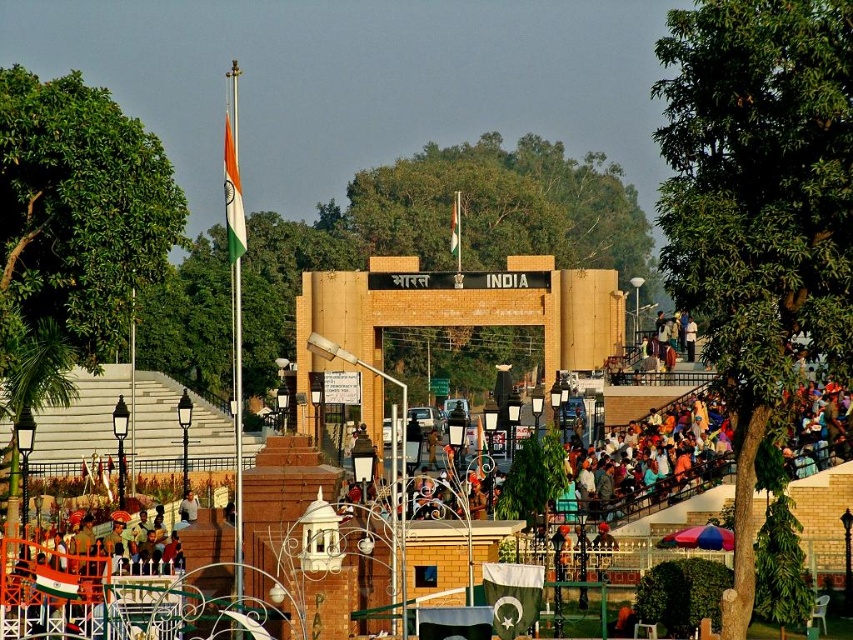
Question: Is tri-color fabric flag at upper center positioned behind tri-color fabric flag at center?

Choices:
 (A) no
 (B) yes

Answer: (A)

Question: Which object is farther from the camera taking this photo?

Choices:
 (A) tri-color fabric flag at center
 (B) tri-color fabric flag at upper center

Answer: (A)

Question: Among these objects, which one is nearest to the camera?

Choices:
 (A) tri-color fabric flag at upper center
 (B) tri-color fabric flag at center

Answer: (A)

Question: Where is tri-color fabric flag at upper center located in relation to tri-color fabric flag at center in the image?

Choices:
 (A) above
 (B) below

Answer: (A)

Question: Can you confirm if tri-color fabric flag at upper center is bigger than tri-color fabric flag at center?

Choices:
 (A) no
 (B) yes

Answer: (B)

Question: Which point is farther from the camera taking this photo?

Choices:
 (A) (456, 224)
 (B) (227, 212)

Answer: (A)